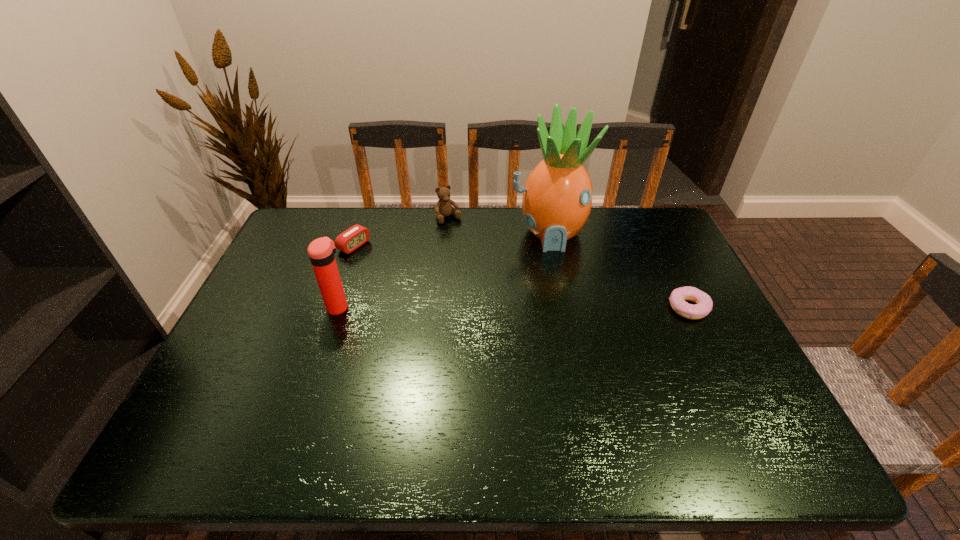
At what (x,y) coordinates should I click in order to perform the action: click on teddy bear present at the far edge. Please return your answer as a coordinate pair (x, y). This screenshot has width=960, height=540. Looking at the image, I should click on (443, 208).

Locate an element on the screen. alarm clock that is at the far edge is located at coordinates (354, 237).

At what (x,y) coordinates should I click in order to perform the action: click on object that is at the right edge. Please return your answer as a coordinate pair (x, y). Looking at the image, I should click on click(x=704, y=304).

Where is `free spot at the far edge of the desktop`? free spot at the far edge of the desktop is located at coordinates (479, 222).

Find the location of `blank space at the near edge of the desktop`. blank space at the near edge of the desktop is located at coordinates (601, 390).

Image resolution: width=960 pixels, height=540 pixels. Identify the location of free space at the left edge of the desktop. (284, 269).

Identify the location of vacant region at the right edge of the desktop. Image resolution: width=960 pixels, height=540 pixels. (648, 250).

This screenshot has height=540, width=960. In order to click on vacant region at the near left corner of the desktop in this screenshot , I will do `click(246, 415)`.

You are a GUI agent. You are given a task and a screenshot of the screen. Output one action in this format:
    pyautogui.click(x=<x>, y=<y>)
    Task: Click on the vacant space at the far right corner of the desktop
    This screenshot has width=960, height=540.
    Given the screenshot: What is the action you would take?
    pyautogui.click(x=657, y=228)

Find the location of a particular element. Image resolution: width=960 pixels, height=540 pixels. free space at the near right corner is located at coordinates (709, 388).